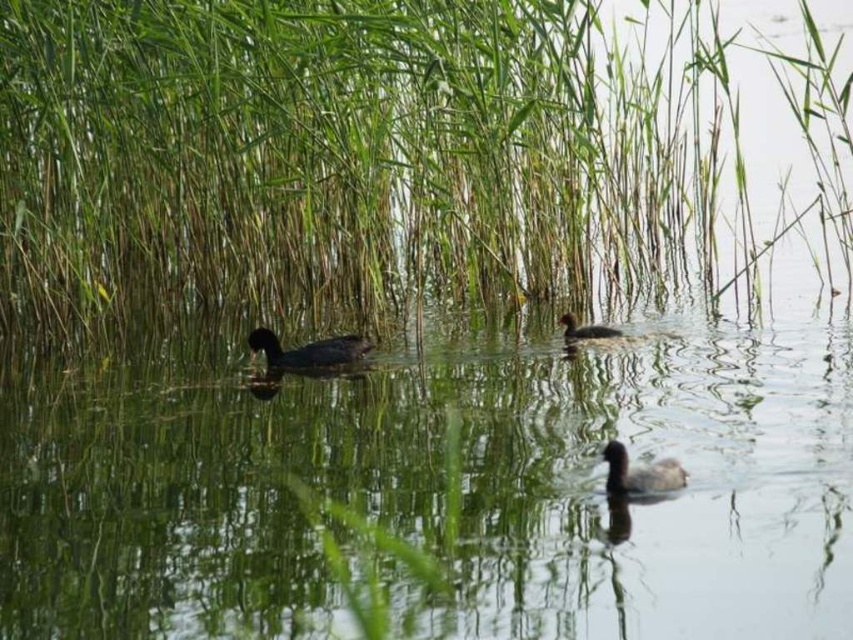
You are standing on a wooden pier 30 feet away from the water. You see a dark brown matte duck at center. Can you reach the duck with a 3.2 feet long fishing rod?

The dark brown matte duck at center is 26.80 feet from viewer. Since the pier is 30 feet away from the water, the total distance to the duck would be 30 feet plus 26.80 feet, totaling 56.80 feet. The fishing rod is only 3.2 feet long, so it is not possible to reach the duck with it.

You are a photographer trying to capture the dark brown matte duck at center and the dark brown feathers at center in the same frame. Based on their positions, which one is closer to the camera?

The dark brown matte duck at center is located below the dark brown feathers at center, so the dark brown feathers at center are closer to the camera.

You are a photographer trying to capture a clear shot of the black matte duck at center. However, there is green leafy grass at center blocking your view. Can you adjust your position to see the duck behind the grass?

The green leafy grass at center is further to the viewer than black matte duck at center, so moving your camera position closer to the water or lowering your angle might allow you to see under the grass and capture the duck behind.